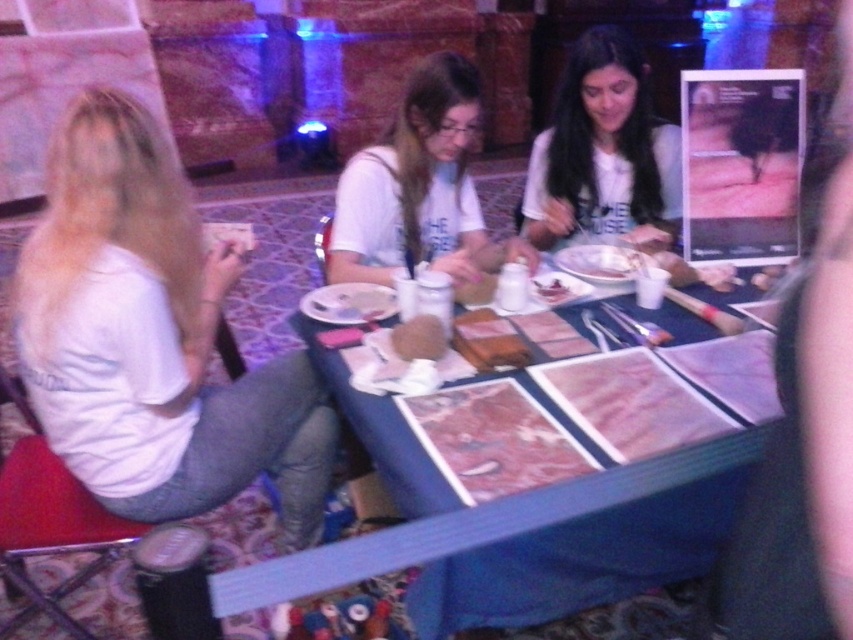
Question: Is blue fabric table at center below white matte shirt at upper center?

Choices:
 (A) no
 (B) yes

Answer: (B)

Question: Which of these objects is positioned farthest from the slightly browned bread at center?

Choices:
 (A) white matte shirt at left
 (B) white cotton shirt at center
 (C) blue fabric table at center

Answer: (A)

Question: From the image, what is the correct spatial relationship of matte brown paper at center in relation to slightly browned bread at center?

Choices:
 (A) below
 (B) above

Answer: (A)

Question: Which point is closer to the camera?

Choices:
 (A) (142, 246)
 (B) (577, 141)
 (C) (543, 300)

Answer: (A)

Question: Which point is farther to the camera?

Choices:
 (A) (614, 184)
 (B) (430, 173)

Answer: (A)

Question: Is white cotton shirt at center closer to the viewer compared to slightly browned bread at center?

Choices:
 (A) no
 (B) yes

Answer: (A)